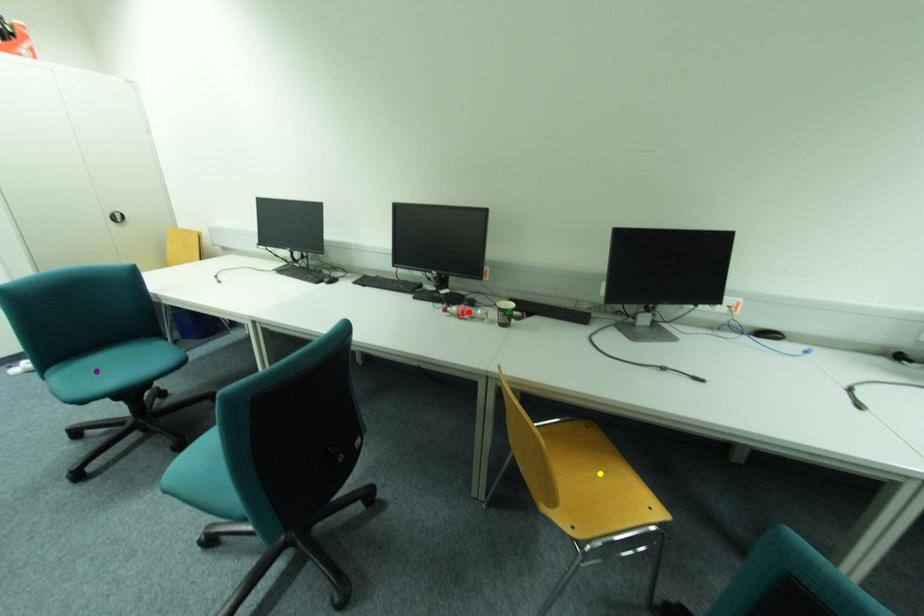
Order these from nearest to farthest:
red point, purple point, yellow point

purple point, red point, yellow point